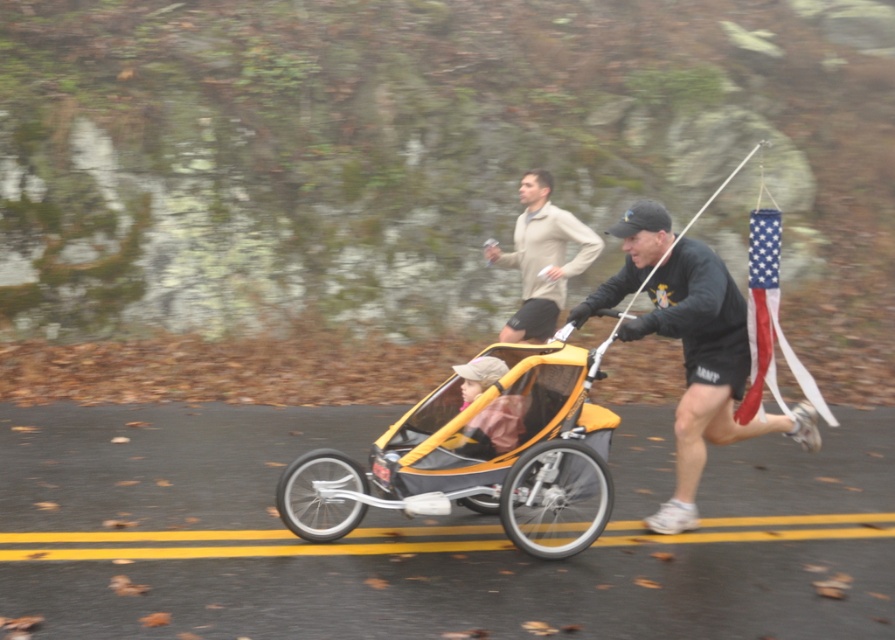
You are a pedestrian trying to cross the road where the yellow solid lines at center and the light beige sweater at center are located. Considering their widths, which one is wider?

The yellow solid lines at center are wider than the light beige sweater at center.